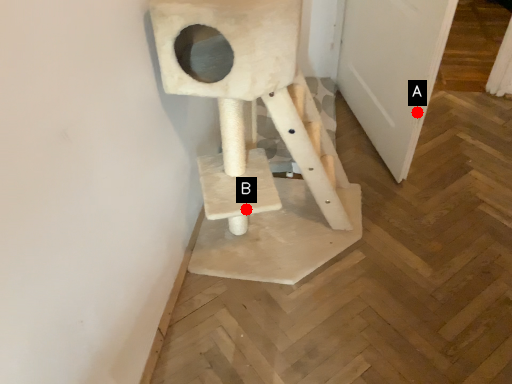
Question: Two points are circled on the image, labeled by A and B beside each circle. Which point is further to the camera?

Choices:
 (A) A is further
 (B) B is further

Answer: (A)